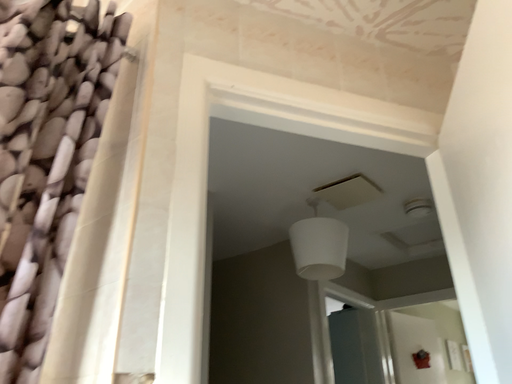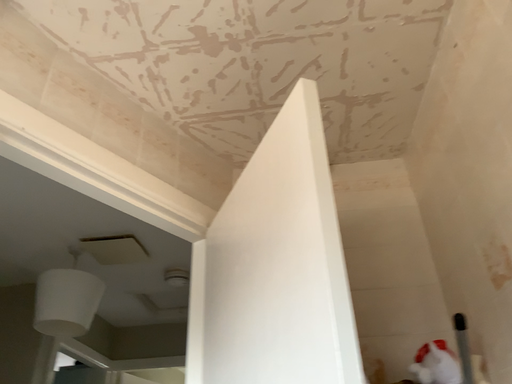
Question: Which way did the camera rotate in the video?

Choices:
 (A) rotated right
 (B) rotated left

Answer: (A)